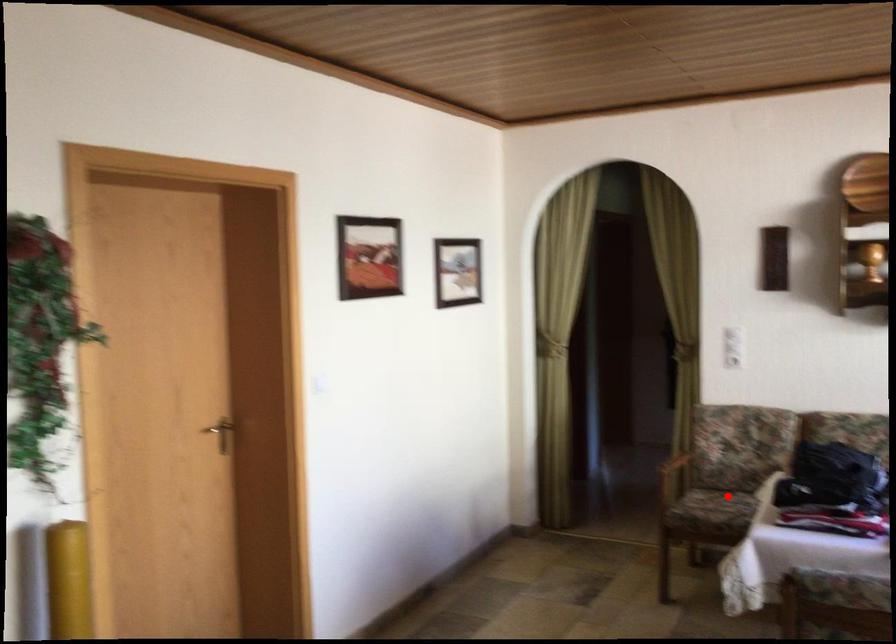
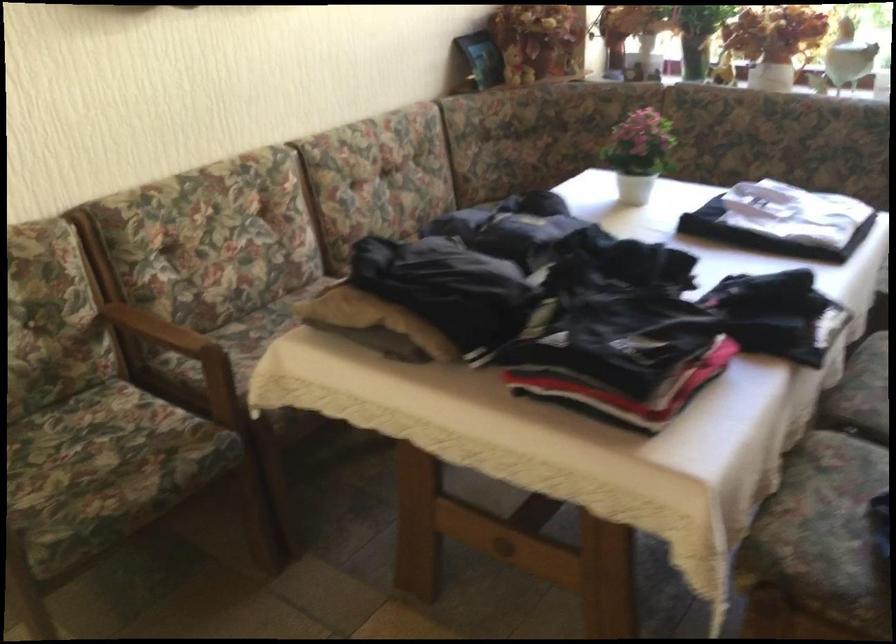
Question: I am providing you with two images of the same scene from different viewpoints. Given a red point in image1, look at the same physical point in image2. Is it:

Choices:
 (A) Closer to the viewpoint
 (B) Farther from the viewpoint

Answer: (A)